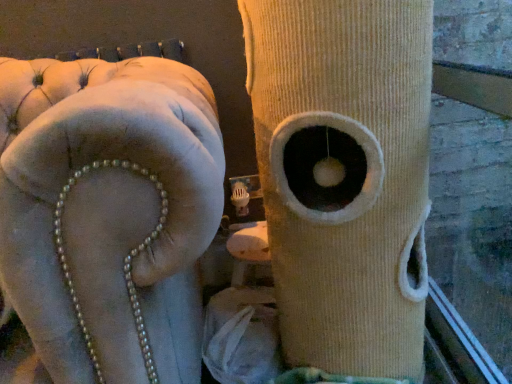
Describe the element at coordinates (108, 214) in the screenshot. I see `velvet beige sofa at upper left` at that location.

Consider the image. In order to face velvet beige sofa at upper left, should I rotate leftwards or rightwards?

To align with it, rotate left about 27.432°.

The image size is (512, 384). Find the location of `velvet beige sofa at upper left`. velvet beige sofa at upper left is located at coordinates click(108, 214).

Describe the element at coordinates (344, 179) in the screenshot. Image resolution: width=512 pixels, height=384 pixels. I see `beige corduroy cat tree at center` at that location.

You are a GUI agent. You are given a task and a screenshot of the screen. Output one action in this format:
    pyautogui.click(x=<x>, y=<y>)
    Task: Click on the beige corduroy cat tree at center
    This screenshot has width=512, height=384.
    Given the screenshot: What is the action you would take?
    pyautogui.click(x=344, y=179)

What is the approximate height of beige corduroy cat tree at center?

The height of beige corduroy cat tree at center is 89.71 centimeters.

Locate an element on the screen. The image size is (512, 384). velvet beige sofa at upper left is located at coordinates (108, 214).

From the picture: Considering the positions of objects velvet beige sofa at upper left and beige corduroy cat tree at center in the image provided, who is more to the right, velvet beige sofa at upper left or beige corduroy cat tree at center?

beige corduroy cat tree at center is more to the right.

Is velvet beige sofa at upper left in front of or behind beige corduroy cat tree at center in the image?

velvet beige sofa at upper left is in front of beige corduroy cat tree at center.

Which is behind, point (75, 165) or point (298, 32)?

The point (298, 32) is behind.

From the image's perspective, is velvet beige sofa at upper left located above beige corduroy cat tree at center?

No, from the image's perspective, velvet beige sofa at upper left is not above beige corduroy cat tree at center.

Looking at this image, from a real-world perspective, is velvet beige sofa at upper left on top of beige corduroy cat tree at center?

No, from a real-world perspective, velvet beige sofa at upper left is not on top of beige corduroy cat tree at center.

Does velvet beige sofa at upper left have a greater width compared to beige corduroy cat tree at center?

Indeed, velvet beige sofa at upper left has a greater width compared to beige corduroy cat tree at center.

In terms of height, does velvet beige sofa at upper left look taller or shorter compared to beige corduroy cat tree at center?

velvet beige sofa at upper left is taller than beige corduroy cat tree at center.

Considering the relative sizes of velvet beige sofa at upper left and beige corduroy cat tree at center in the image provided, is velvet beige sofa at upper left bigger than beige corduroy cat tree at center?

Correct, velvet beige sofa at upper left is larger in size than beige corduroy cat tree at center.

Would you say velvet beige sofa at upper left is inside or outside beige corduroy cat tree at center?

velvet beige sofa at upper left cannot be found inside beige corduroy cat tree at center.

In the scene shown: Is velvet beige sofa at upper left placed right next to beige corduroy cat tree at center?

No, velvet beige sofa at upper left is not making contact with beige corduroy cat tree at center.

Is velvet beige sofa at upper left looking in the opposite direction of beige corduroy cat tree at center?

velvet beige sofa at upper left does not have its back to beige corduroy cat tree at center.

Can you tell me how much velvet beige sofa at upper left and beige corduroy cat tree at center differ in facing direction?

They differ by 5.84 degrees in their facing directions.

Locate an element on the screen. This screenshot has height=384, width=512. tree trunk on the right of the velvet beige sofa at upper left is located at coordinates (344, 179).

Considering the positions of objects beige corduroy cat tree at center and velvet beige sofa at upper left in the image provided, who is more to the right, beige corduroy cat tree at center or velvet beige sofa at upper left?

Positioned to the right is beige corduroy cat tree at center.

Considering the relative positions of beige corduroy cat tree at center and velvet beige sofa at upper left in the image provided, is beige corduroy cat tree at center behind velvet beige sofa at upper left?

Yes, beige corduroy cat tree at center is further from the viewer.

Which is farther, (397,132) or (127,161)?

Positioned behind is point (397,132).

From the image's perspective, between beige corduroy cat tree at center and velvet beige sofa at upper left, who is located below?

From the image's view, velvet beige sofa at upper left is below.

From a real-world perspective, who is located lower, beige corduroy cat tree at center or velvet beige sofa at upper left?

velvet beige sofa at upper left is physically lower.

Considering the sizes of beige corduroy cat tree at center and velvet beige sofa at upper left in the image, is beige corduroy cat tree at center wider or thinner than velvet beige sofa at upper left?

In the image, beige corduroy cat tree at center appears to be more narrow than velvet beige sofa at upper left.

From their relative heights in the image, would you say beige corduroy cat tree at center is taller or shorter than velvet beige sofa at upper left?

Considering their sizes, beige corduroy cat tree at center has less height than velvet beige sofa at upper left.

Consider the image. Considering the sizes of objects beige corduroy cat tree at center and velvet beige sofa at upper left in the image provided, who is bigger, beige corduroy cat tree at center or velvet beige sofa at upper left?

With larger size is velvet beige sofa at upper left.

Does beige corduroy cat tree at center contain velvet beige sofa at upper left?

No, velvet beige sofa at upper left is not a part of beige corduroy cat tree at center.

Is beige corduroy cat tree at center directly adjacent to velvet beige sofa at upper left?

No, beige corduroy cat tree at center is not touching velvet beige sofa at upper left.

In the scene shown: Is beige corduroy cat tree at center facing away from velvet beige sofa at upper left?

No, velvet beige sofa at upper left is not at the back of beige corduroy cat tree at center.

Can you tell me how much beige corduroy cat tree at center and velvet beige sofa at upper left differ in facing direction?

The angle between the facing direction of beige corduroy cat tree at center and the facing direction of velvet beige sofa at upper left is 5.84 degrees.

Measure the distance from beige corduroy cat tree at center to velvet beige sofa at upper left.

beige corduroy cat tree at center is 12.92 inches away from velvet beige sofa at upper left.

In order to click on furniture lying on the left of beige corduroy cat tree at center in this screenshot , I will do `click(108, 214)`.

Locate an element on the screen. The image size is (512, 384). tree trunk above the velvet beige sofa at upper left (from a real-world perspective) is located at coordinates (344, 179).

In order to click on tree trunk behind the velvet beige sofa at upper left in this screenshot , I will do `click(344, 179)`.